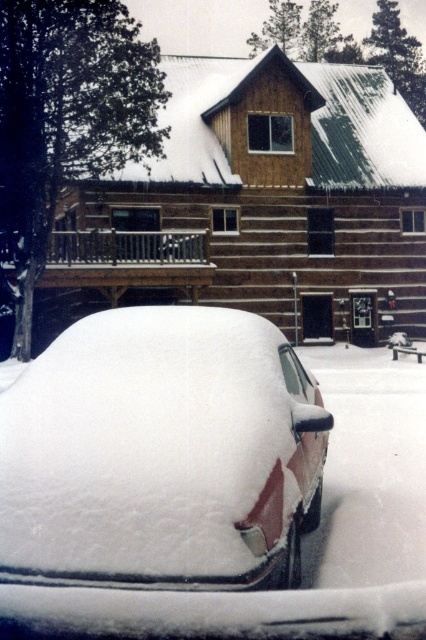
Does wooden cabin at center have a greater width compared to snow-covered car at center?

Indeed, wooden cabin at center has a greater width compared to snow-covered car at center.

Based on the photo, can you confirm if wooden cabin at center is bigger than snow-covered car at center?

Indeed, wooden cabin at center has a larger size compared to snow-covered car at center.

This screenshot has width=426, height=640. Describe the element at coordinates (261, 202) in the screenshot. I see `wooden cabin at center` at that location.

The height and width of the screenshot is (640, 426). What are the coordinates of `wooden cabin at center` in the screenshot? It's located at (261, 202).